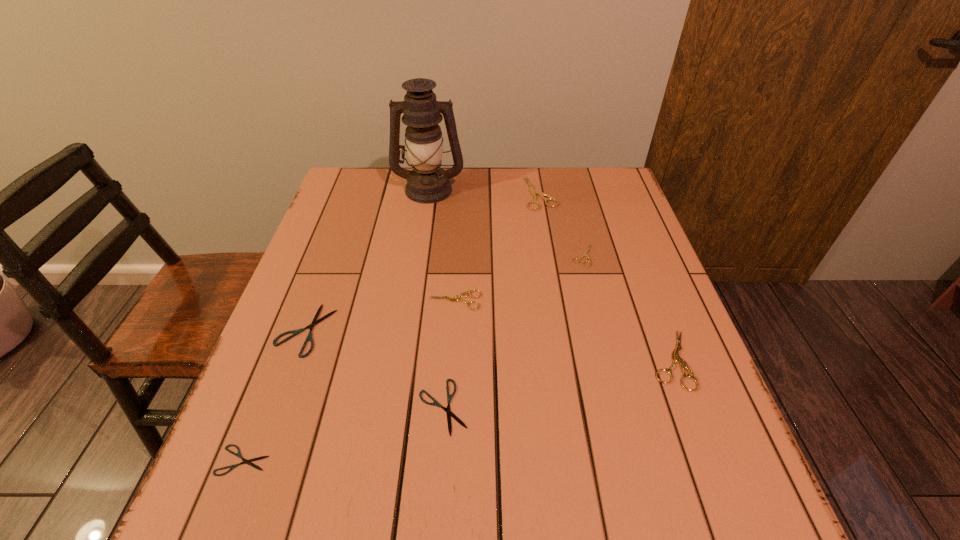
At what (x,y) coordinates should I click in order to perform the action: click on oil lamp. Please return your answer as a coordinate pair (x, y). The width and height of the screenshot is (960, 540). Looking at the image, I should click on (427, 183).

Locate an element on the screen. The height and width of the screenshot is (540, 960). blue oil lamp is located at coordinates (427, 183).

Find the location of a particular element. This screenshot has width=960, height=540. the third object from right to left is located at coordinates (534, 193).

Identify the location of the tallest shears. Image resolution: width=960 pixels, height=540 pixels. (534, 193).

Locate an element on the screen. Image resolution: width=960 pixels, height=540 pixels. the rightmost beige shears is located at coordinates (676, 359).

You are a GUI agent. You are given a task and a screenshot of the screen. Output one action in this format:
    pyautogui.click(x=<x>, y=<y>)
    Task: Click on the third tallest object
    The width and height of the screenshot is (960, 540).
    Given the screenshot: What is the action you would take?
    pyautogui.click(x=676, y=359)

What are the coordinates of `the third tallest shears` in the screenshot? It's located at (455, 299).

Identify the location of the second nearest beige shears. The image size is (960, 540). (455, 299).

You are a GUI agent. You are given a task and a screenshot of the screen. Output one action in this format:
    pyautogui.click(x=<x>, y=<y>)
    Task: Click on the biggest black shears
    
    Given the screenshot: What is the action you would take?
    pyautogui.click(x=295, y=332)

Identify the location of the seventh object from left to right. The image size is (960, 540). (585, 253).